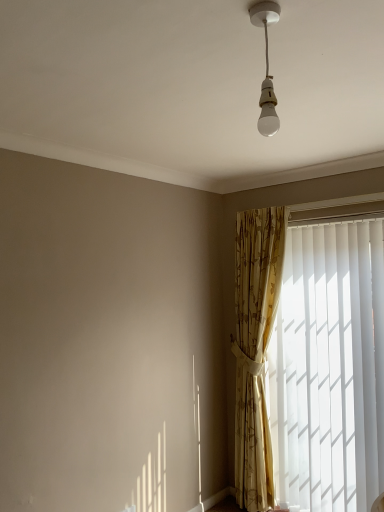
Question: From a real-world perspective, is white glossy bulb at upper center over gold floral fabric curtain at right?

Choices:
 (A) yes
 (B) no

Answer: (A)

Question: Is white glossy bulb at upper center thinner than gold floral fabric curtain at right?

Choices:
 (A) no
 (B) yes

Answer: (B)

Question: Does white glossy bulb at upper center appear on the right side of gold floral fabric curtain at right?

Choices:
 (A) no
 (B) yes

Answer: (A)

Question: Is white glossy bulb at upper center not close to gold floral fabric curtain at right?

Choices:
 (A) no
 (B) yes

Answer: (B)

Question: Is white glossy bulb at upper center positioned behind gold floral fabric curtain at right?

Choices:
 (A) yes
 (B) no

Answer: (B)

Question: Does white glossy bulb at upper center have a lesser height compared to gold floral fabric curtain at right?

Choices:
 (A) yes
 (B) no

Answer: (A)

Question: Considering the relative positions of gold floral fabric curtain at right and white glossy bulb at upper center in the image provided, is gold floral fabric curtain at right behind white glossy bulb at upper center?

Choices:
 (A) yes
 (B) no

Answer: (A)

Question: Is gold floral fabric curtain at right positioned before white glossy bulb at upper center?

Choices:
 (A) yes
 (B) no

Answer: (B)

Question: Does gold floral fabric curtain at right turn towards white glossy bulb at upper center?

Choices:
 (A) no
 (B) yes

Answer: (A)

Question: Is gold floral fabric curtain at right smaller than white glossy bulb at upper center?

Choices:
 (A) no
 (B) yes

Answer: (A)

Question: Is gold floral fabric curtain at right to the right of white glossy bulb at upper center from the viewer's perspective?

Choices:
 (A) yes
 (B) no

Answer: (A)

Question: Is gold floral fabric curtain at right positioned with its back to white glossy bulb at upper center?

Choices:
 (A) yes
 (B) no

Answer: (B)

Question: Is gold floral fabric curtain at right behind white vertical blinds at right?

Choices:
 (A) no
 (B) yes

Answer: (B)